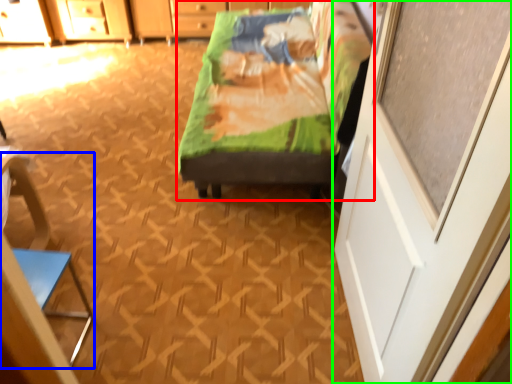
Question: Estimate the real-world distances between objects in this image. Which object is closer to furniture (highlighted by a red box), armchair (highlighted by a blue box) or screen door (highlighted by a green box)?

Choices:
 (A) armchair
 (B) screen door

Answer: (B)